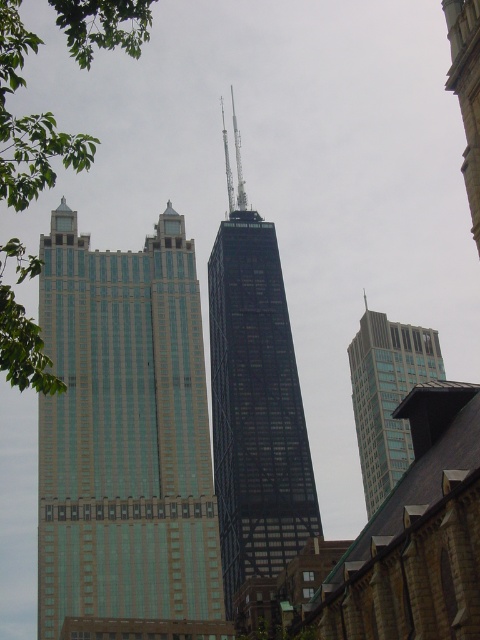
You are standing at a point in the city. You want to reach a specific location marked by the point at coordinates point (112, 515). If your current distance to that point is 116.30 meters, and you walk towards it at a speed of 1.5 meters per second, how many minutes will it take you to arrive?

The distance to point (112, 515) is 116.30 meters. At a speed of 1.5 meters per second, it will take 116.30 divided by 1.5 equals approximately 77.53 seconds, which is about 1.29 minutes. So, it will take roughly 1.29 minutes to reach point (112, 515).

You are a bird looking for a nesting spot. You see a green leafy tree at left and a smooth stone spire at upper right. Which location would allow you to build a higher nest?

The green leafy tree at left is much taller than the smooth stone spire at upper right, so the nest can be built higher in the green leafy tree at left.

You are a bird flying over the city. You see the green leafy tree at left and the smooth stone spire at upper right. Which object is higher in the sky from your perspective?

The green leafy tree at left is located above the smooth stone spire at upper right, so from the bird flying over the city perspective, the green leafy tree at left is higher in the sky.